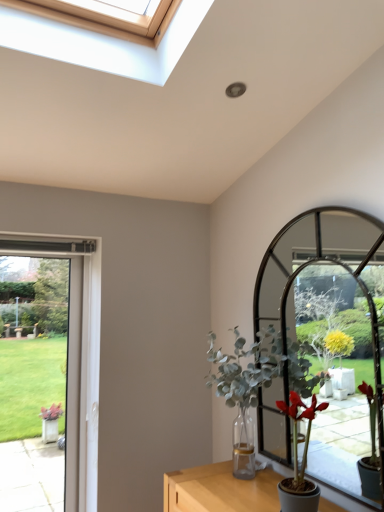
The width and height of the screenshot is (384, 512). Describe the element at coordinates (246, 369) in the screenshot. I see `green leafy plant at center, the 1th houseplant viewed from the back` at that location.

At what (x,y) coordinates should I click in order to perform the action: click on green leafy plant at center, the 1th houseplant viewed from the back. Please return your answer as a coordinate pair (x, y). This screenshot has height=512, width=384. Looking at the image, I should click on (246, 369).

Based on the photo, between matte green plant at right, placed as the first houseplant when sorted from front to back, and clear glass door at left, which one has less height?

matte green plant at right, placed as the first houseplant when sorted from front to back.

Looking at this image, is matte green plant at right, placed as the first houseplant when sorted from front to back, situated inside clear glass door at left or outside?

matte green plant at right, placed as the first houseplant when sorted from front to back, is not enclosed by clear glass door at left.

Who is bigger, matte green plant at right, the 2th houseplant when ordered from back to front, or clear glass door at left?

clear glass door at left is bigger.

From the picture: From a real-world perspective, is clear glass door at left on top of matte green plant at right, the 2th houseplant when ordered from back to front?

Yes, from a real-world perspective, clear glass door at left is on top of matte green plant at right, the 2th houseplant when ordered from back to front.

How different are the orientations of clear glass door at left and matte green plant at right, placed as the first houseplant when sorted from front to back, in degrees?

The angle between the facing direction of clear glass door at left and the facing direction of matte green plant at right, placed as the first houseplant when sorted from front to back, is 89.9 degrees.

Can you confirm if clear glass door at left is smaller than matte green plant at right, the 2th houseplant when ordered from back to front?

No, clear glass door at left is not smaller than matte green plant at right, the 2th houseplant when ordered from back to front.

Is point (24, 238) closer or farther from the camera than point (285, 492)?

Clearly, point (24, 238) is more distant from the camera than point (285, 492).

At what (x,y) coordinates should I click in order to perform the action: click on the 1st houseplant in front of the clear glass door at left, counting from the anchor's position. Please return your answer as a coordinate pair (x, y). The height and width of the screenshot is (512, 384). Looking at the image, I should click on (246, 369).

From the image's perspective, which object appears higher, clear glass door at left or green leafy plant at center, the second houseplant when ordered from front to back?

green leafy plant at center, the second houseplant when ordered from front to back.

Is point (91, 281) in front of point (301, 386)?

No, it is not.

Considering the positions of objects clear glass door at left and green leafy plant at center, the second houseplant when ordered from front to back, in the image provided, who is more to the left, clear glass door at left or green leafy plant at center, the second houseplant when ordered from front to back,?

From the viewer's perspective, clear glass door at left appears more on the left side.

You are a GUI agent. You are given a task and a screenshot of the screen. Output one action in this format:
    pyautogui.click(x=<x>, y=<y>)
    Task: Click on the houseplant above the matte green plant at right, the 2th houseplant when ordered from back to front (from the image's perspective)
    
    Given the screenshot: What is the action you would take?
    pyautogui.click(x=246, y=369)

Consider the image. Between green leafy plant at center, the second houseplant when ordered from front to back, and matte green plant at right, the 2th houseplant when ordered from back to front, which one appears on the right side from the viewer's perspective?

matte green plant at right, the 2th houseplant when ordered from back to front.

In the scene shown: Which is in front, green leafy plant at center, the second houseplant when ordered from front to back, or matte green plant at right, the 2th houseplant when ordered from back to front?

matte green plant at right, the 2th houseplant when ordered from back to front, is closer to the camera.

Which of these two, green leafy plant at center, the 1th houseplant viewed from the back, or clear glass door at left, stands taller?

clear glass door at left.

From a real-world perspective, who is located higher, green leafy plant at center, the 1th houseplant viewed from the back, or clear glass door at left?

From a 3D spatial view, green leafy plant at center, the 1th houseplant viewed from the back, is above.

Does green leafy plant at center, the 1th houseplant viewed from the back, have a larger size compared to clear glass door at left?

Correct, green leafy plant at center, the 1th houseplant viewed from the back, is larger in size than clear glass door at left.

How different are the orientations of green leafy plant at center, the second houseplant when ordered from front to back, and clear glass door at left in degrees?

The facing directions of green leafy plant at center, the second houseplant when ordered from front to back, and clear glass door at left are 89.1 degrees apart.

Consider the image. Is matte green plant at right, placed as the first houseplant when sorted from front to back, taller than green leafy plant at center, the 1th houseplant viewed from the back?

In fact, matte green plant at right, placed as the first houseplant when sorted from front to back, may be shorter than green leafy plant at center, the 1th houseplant viewed from the back.

Locate an element on the screen. houseplant that appears above the matte green plant at right, placed as the first houseplant when sorted from front to back (from a real-world perspective) is located at coordinates (246, 369).

From the picture: From the image's perspective, is matte green plant at right, the 2th houseplant when ordered from back to front, located above or below green leafy plant at center, the second houseplant when ordered from front to back?

matte green plant at right, the 2th houseplant when ordered from back to front, is below green leafy plant at center, the second houseplant when ordered from front to back.

Find the location of a particular element. houseplant below the clear glass door at left (from the image's perspective) is located at coordinates (297, 460).

Image resolution: width=384 pixels, height=512 pixels. I want to click on window frame behind the matte green plant at right, the 2th houseplant when ordered from back to front, so click(x=78, y=362).

Estimate the real-world distances between objects in this image. Which object is further from clear glass door at left, green leafy plant at center, the 1th houseplant viewed from the back, or matte green plant at right, the 2th houseplant when ordered from back to front?

matte green plant at right, the 2th houseplant when ordered from back to front, is further to clear glass door at left.

Looking at the image, which one is located further to clear glass door at left, matte green plant at right, the 2th houseplant when ordered from back to front, or green leafy plant at center, the second houseplant when ordered from front to back?

matte green plant at right, the 2th houseplant when ordered from back to front, is further to clear glass door at left.

From the image, which object appears to be farther from matte green plant at right, the 2th houseplant when ordered from back to front, green leafy plant at center, the second houseplant when ordered from front to back, or clear glass door at left?

clear glass door at left is positioned further to the anchor matte green plant at right, the 2th houseplant when ordered from back to front.

From the image, which object appears to be nearer to green leafy plant at center, the second houseplant when ordered from front to back, clear glass door at left or matte green plant at right, placed as the first houseplant when sorted from front to back?

matte green plant at right, placed as the first houseplant when sorted from front to back, is positioned closer to the anchor green leafy plant at center, the second houseplant when ordered from front to back.

When comparing their distances from matte green plant at right, the 2th houseplant when ordered from back to front, does clear glass door at left or green leafy plant at center, the 1th houseplant viewed from the back, seem closer?

Among the two, green leafy plant at center, the 1th houseplant viewed from the back, is located nearer to matte green plant at right, the 2th houseplant when ordered from back to front.

Which object lies further to the anchor point green leafy plant at center, the second houseplant when ordered from front to back, matte green plant at right, the 2th houseplant when ordered from back to front, or clear glass door at left?

Based on the image, clear glass door at left appears to be further to green leafy plant at center, the second houseplant when ordered from front to back.

Where is `houseplant between clear glass door at left and matte green plant at right, placed as the first houseplant when sorted from front to back, from left to right`? houseplant between clear glass door at left and matte green plant at right, placed as the first houseplant when sorted from front to back, from left to right is located at coordinates (246, 369).